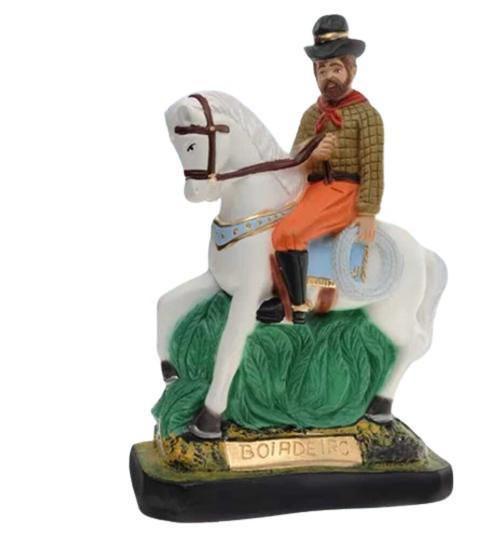
You are a GUI agent. You are given a task and a screenshot of the screen. Output one action in this format:
    pyautogui.click(x=<x>, y=<y>)
    Task: Click on the figurines
    The image size is (504, 540).
    Given the screenshot: What is the action you would take?
    pyautogui.click(x=342, y=499), pyautogui.click(x=374, y=491), pyautogui.click(x=307, y=364), pyautogui.click(x=243, y=368), pyautogui.click(x=248, y=233), pyautogui.click(x=374, y=256)